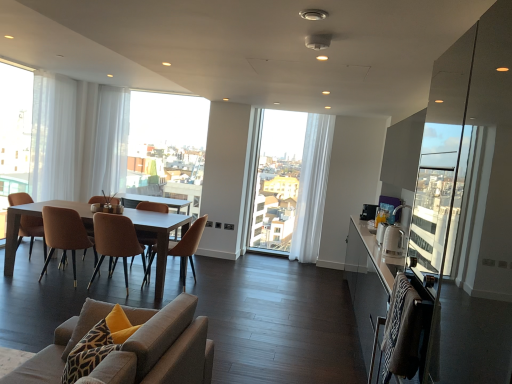
You are a GUI agent. You are given a task and a screenshot of the screen. Output one action in this format:
    pyautogui.click(x=<x>, y=<y>)
    Task: Click on the spots to the right of brown leather chair at center, the 2th chair when ordered from back to front
    
    Given the screenshot: What is the action you would take?
    pos(218,287)